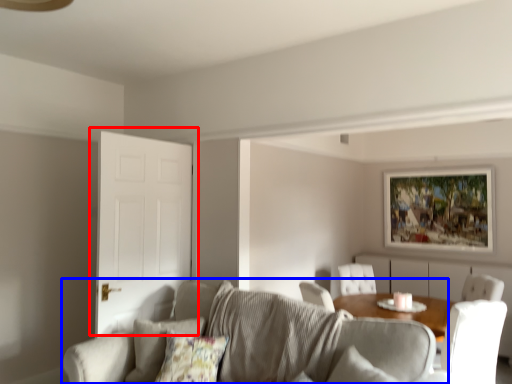
Question: Which of the following is the farthest to the observer, door (highlighted by a red box) or studio couch (highlighted by a blue box)?

Choices:
 (A) door
 (B) studio couch

Answer: (A)